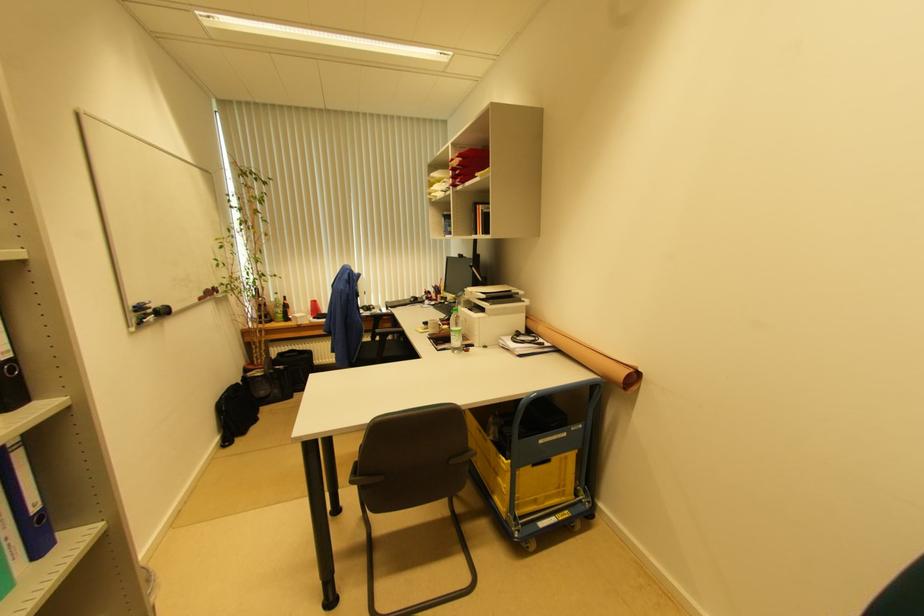
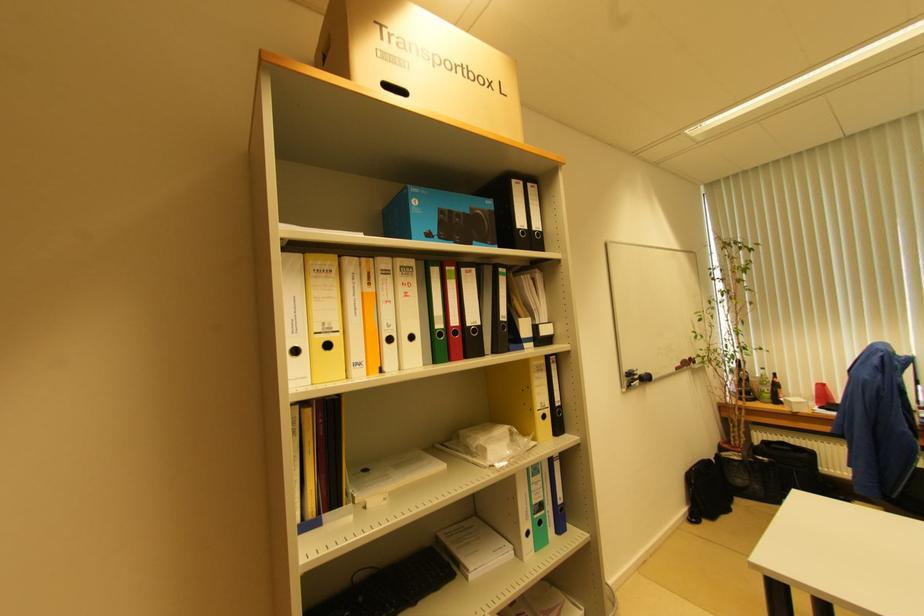
Question: The camera is either moving clockwise (left) or counter-clockwise (right) around the object. The first image is from the beginning of the video and the second image is from the end. Is the camera moving left or right when shooting the video?

Choices:
 (A) Left
 (B) Right

Answer: (B)